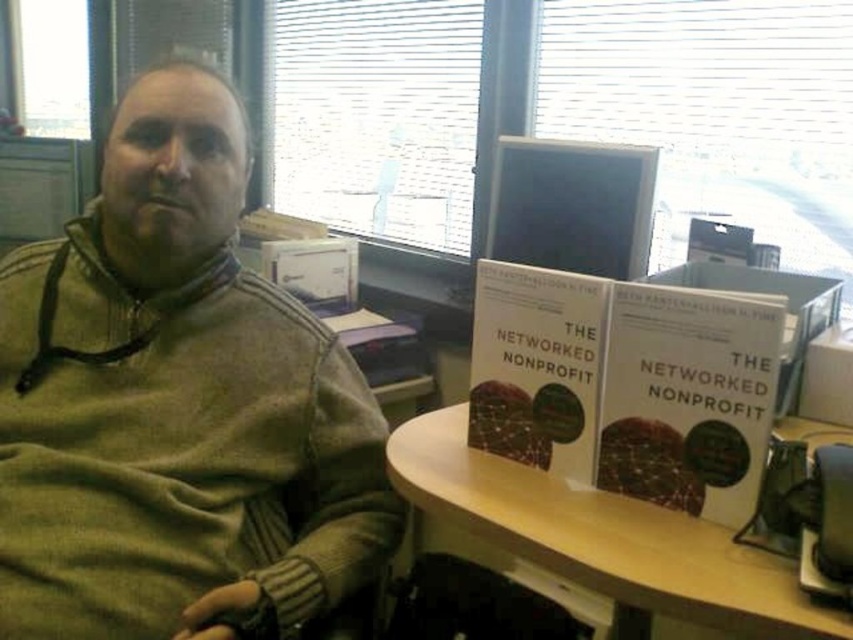
How far apart are white matte book at center and light brown wood table at center?

white matte book at center and light brown wood table at center are 4.84 inches apart.

Is white matte book at center smaller than light brown wood table at center?

Yes.

This screenshot has height=640, width=853. Find the location of `white matte book at center`. white matte book at center is located at coordinates (625, 385).

Who is shorter, green knitwear at center or light brown wood table at center?

light brown wood table at center is shorter.

I want to click on green knitwear at center, so click(x=177, y=404).

Identify the location of green knitwear at center. (177, 404).

In order to click on green knitwear at center in this screenshot , I will do `click(177, 404)`.

Who is taller, light brown wood table at center or matte plastic computer monitor at upper center?

Standing taller between the two is matte plastic computer monitor at upper center.

Which is above, light brown wood table at center or matte plastic computer monitor at upper center?

matte plastic computer monitor at upper center is higher up.

The height and width of the screenshot is (640, 853). What do you see at coordinates (602, 538) in the screenshot?
I see `light brown wood table at center` at bounding box center [602, 538].

Locate an element on the screen. light brown wood table at center is located at coordinates (602, 538).